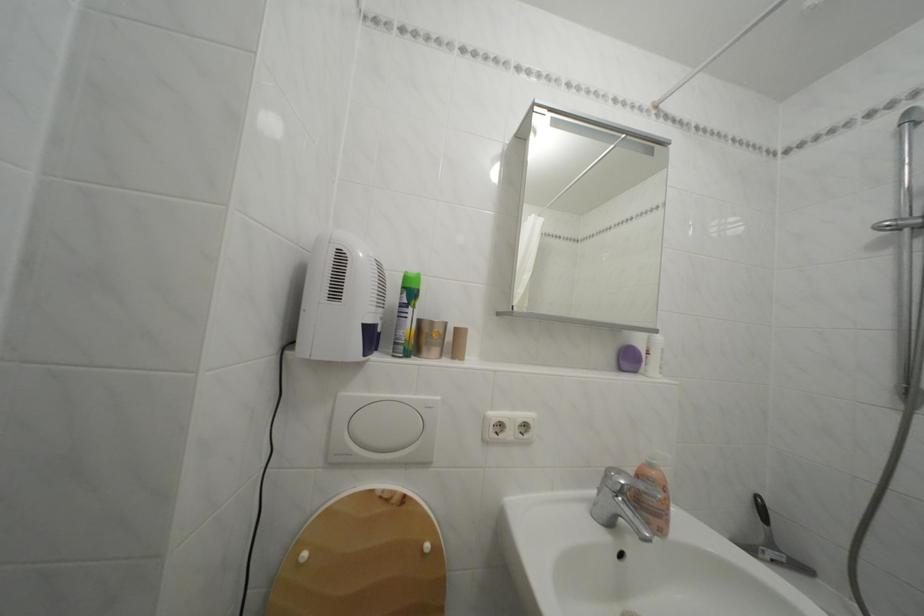
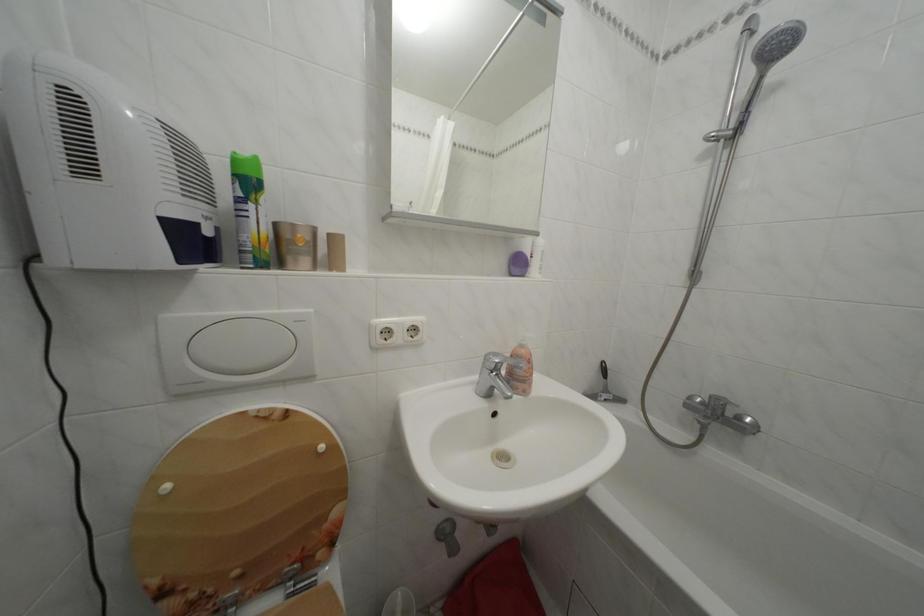
Where in the second image is the point corresponding to the point at 782,553 from the first image?

(614, 397)